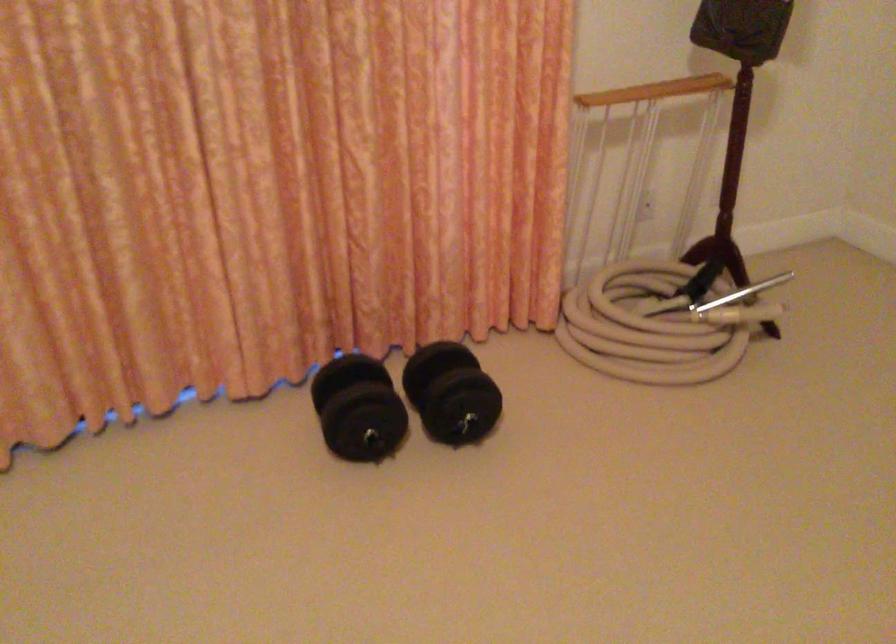
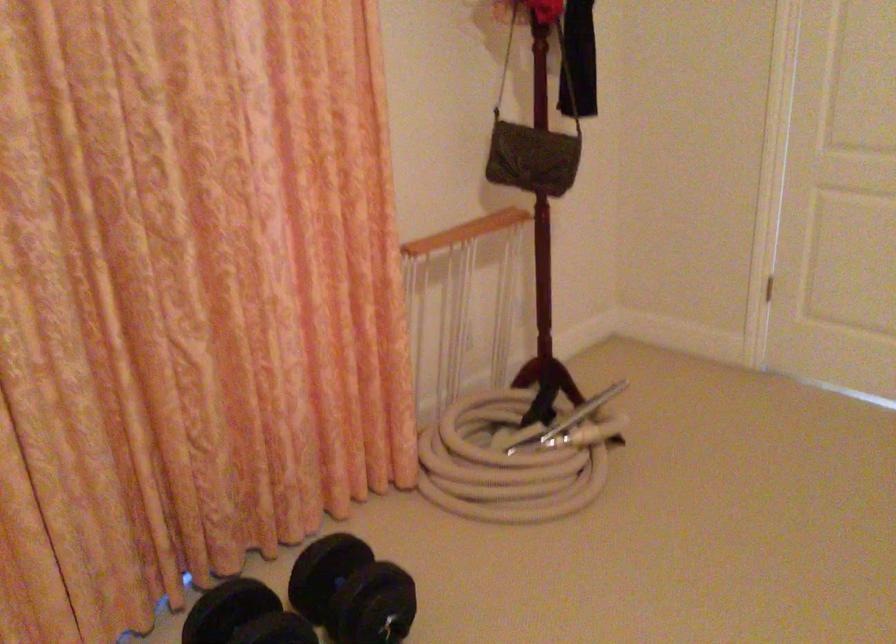
In a continuous first-person perspective shot, in which direction is the camera moving?

The movement direction of the cameraman is left, forward.